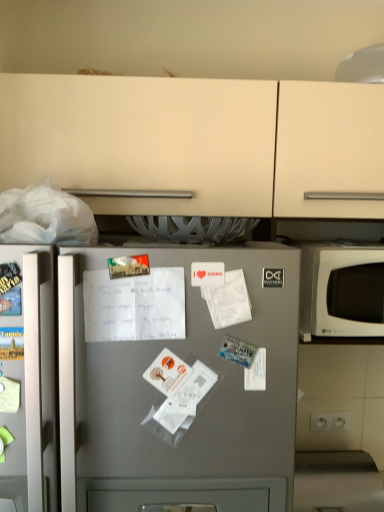
Question: Is there a large distance between white matte microwave at right and satin silver fridge at center?

Choices:
 (A) no
 (B) yes

Answer: (A)

Question: Is white matte microwave at right taller than satin silver fridge at center?

Choices:
 (A) no
 (B) yes

Answer: (A)

Question: Is white matte microwave at right outside of satin silver fridge at center?

Choices:
 (A) no
 (B) yes

Answer: (B)

Question: Is white matte microwave at right behind satin silver fridge at center?

Choices:
 (A) yes
 (B) no

Answer: (A)

Question: Does white matte microwave at right come in front of satin silver fridge at center?

Choices:
 (A) no
 (B) yes

Answer: (A)

Question: From the image's perspective, relative to white matte microwave at right, is satin silver fridge at center above or below?

Choices:
 (A) above
 (B) below

Answer: (B)

Question: Considering the positions of satin silver fridge at center and white matte microwave at right in the image, is satin silver fridge at center bigger or smaller than white matte microwave at right?

Choices:
 (A) big
 (B) small

Answer: (A)

Question: Is point (117, 490) positioned closer to the camera than point (332, 317)?

Choices:
 (A) farther
 (B) closer

Answer: (B)

Question: In the image, is satin silver fridge at center positioned in front of or behind white matte microwave at right?

Choices:
 (A) behind
 (B) front

Answer: (B)

Question: Is point [x=314, y=314] closer or farther from the camera than point [x=94, y=440]?

Choices:
 (A) closer
 (B) farther

Answer: (B)

Question: In terms of height, does white matte microwave at right look taller or shorter compared to satin silver fridge at center?

Choices:
 (A) tall
 (B) short

Answer: (B)

Question: From a real-world perspective, is white matte microwave at right positioned above or below satin silver fridge at center?

Choices:
 (A) below
 (B) above

Answer: (B)

Question: In terms of width, does white matte microwave at right look wider or thinner when compared to satin silver fridge at center?

Choices:
 (A) wide
 (B) thin

Answer: (B)

Question: Looking at their shapes, would you say white paper receipt at center is wider or thinner than satin silver fridge at center?

Choices:
 (A) wide
 (B) thin

Answer: (B)

Question: Is white paper receipt at center in front of or behind satin silver fridge at center in the image?

Choices:
 (A) front
 (B) behind

Answer: (B)